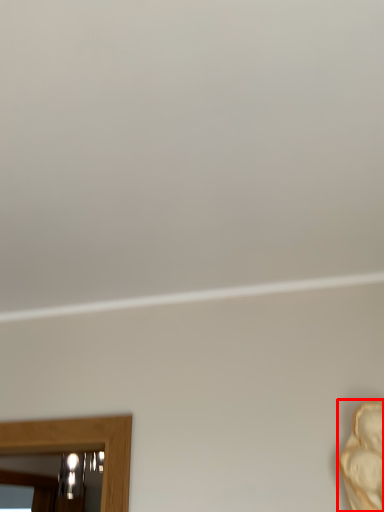
Question: From the image's perspective, considering the relative positions of person (annotated by the red box) and mirror in the image provided, where is person (annotated by the red box) located with respect to the staircase?

Choices:
 (A) above
 (B) below

Answer: (A)